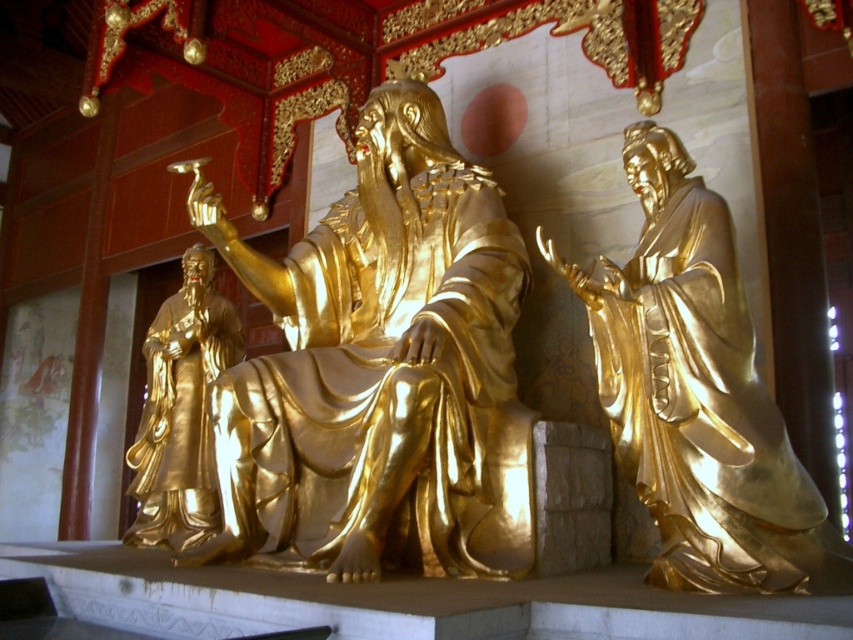
Is gold polished statue at center to the right of gold polished statue at right from the viewer's perspective?

No, gold polished statue at center is not to the right of gold polished statue at right.

Who is taller, gold polished statue at center or gold polished statue at right?

Standing taller between the two is gold polished statue at center.

The width and height of the screenshot is (853, 640). Find the location of `gold polished statue at center`. gold polished statue at center is located at coordinates (370, 362).

Can you confirm if gold polished statue at center is positioned to the left of gold polished statue at left?

Incorrect, gold polished statue at center is not on the left side of gold polished statue at left.

Can you confirm if gold polished statue at center is positioned to the right of gold polished statue at left?

Yes, gold polished statue at center is to the right of gold polished statue at left.

Find the location of a particular element. gold polished statue at center is located at coordinates (370, 362).

Looking at this image, between gold polished statue at right and gold polished statue at left, which one has more height?

With more height is gold polished statue at left.

Find the location of a particular element. The width and height of the screenshot is (853, 640). gold polished statue at right is located at coordinates (698, 396).